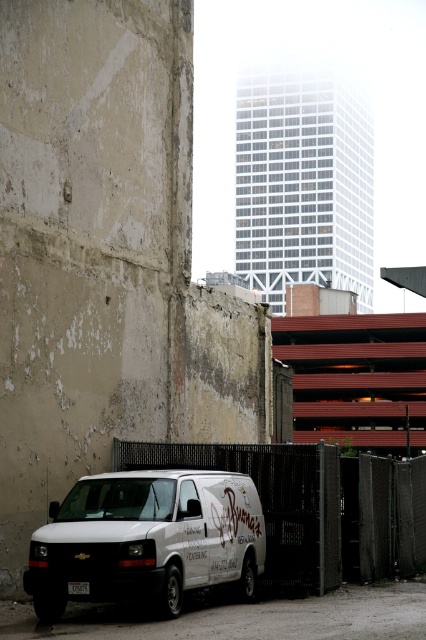
Does white matte van at lower left have a greater width compared to metallic chain-link fence at lower center?

In fact, white matte van at lower left might be narrower than metallic chain-link fence at lower center.

Can you confirm if white matte van at lower left is bigger than metallic chain-link fence at lower center?

Incorrect, white matte van at lower left is not larger than metallic chain-link fence at lower center.

Where is `white matte van at lower left`? The image size is (426, 640). white matte van at lower left is located at coordinates (146, 540).